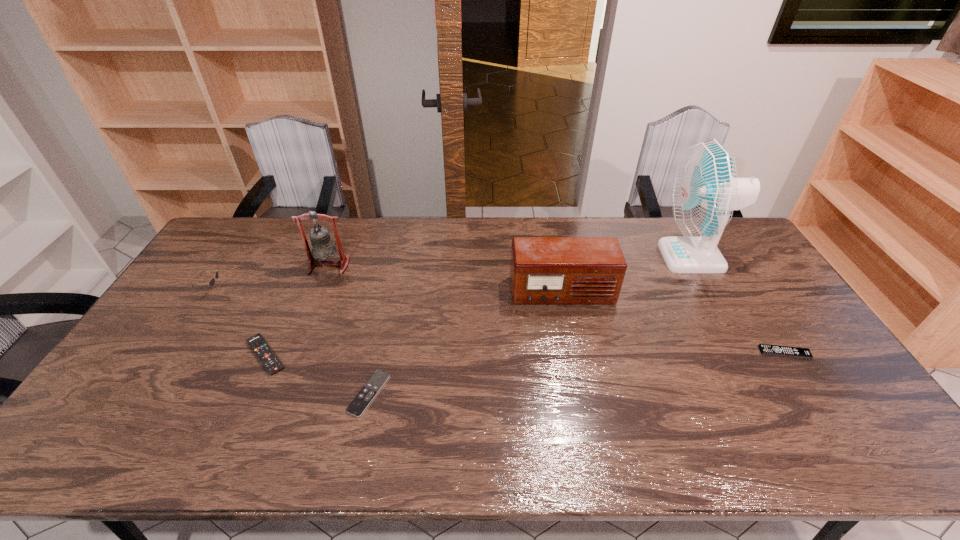
Locate an element on the screen. object that can be found as the third closest to the second tallest object is located at coordinates (x=360, y=403).

Where is `the second closest object to the rightmost remote control`? This screenshot has height=540, width=960. the second closest object to the rightmost remote control is located at coordinates (544, 270).

Locate an element on the screen. The width and height of the screenshot is (960, 540). remote control object that ranks as the third closest to the fourth tallest object is located at coordinates (765, 349).

What are the coordinates of `remote control that stands as the third closest to the radio receiver` in the screenshot? It's located at (272, 364).

Find the location of a particular element. free point that satisfies the following two spatial constraints: 1. in front of the lenses of the fourth shortest object; 2. on the back side of the fourth object from left to right is located at coordinates (144, 393).

Locate an element on the screen. The width and height of the screenshot is (960, 540). free space that satisfies the following two spatial constraints: 1. in front of the lenses of the shortest object; 2. on the right side of the sunglasses is located at coordinates (144, 393).

At what (x,y) coordinates should I click in order to perform the action: click on vacant area that satisfies the following two spatial constraints: 1. in front of the lenses of the leftmost remote control; 2. on the left side of the fourth tallest object. Please return your answer as a coordinate pair (x, y). Looking at the image, I should click on coord(169,355).

Find the location of a particular element. The image size is (960, 540). vacant area in the image that satisfies the following two spatial constraints: 1. on the back side of the leftmost remote control; 2. on the right side of the rightmost remote control is located at coordinates (267, 353).